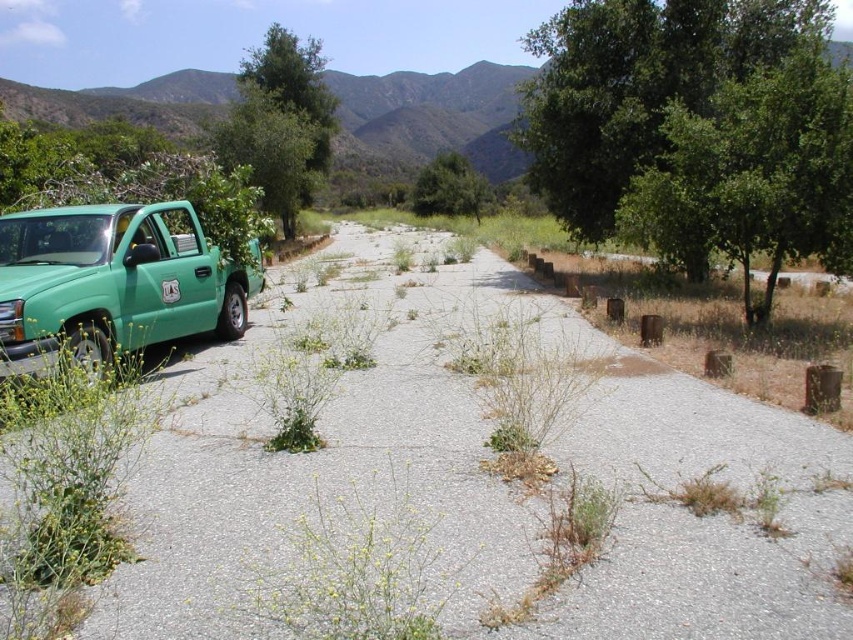
Question: In this image, where is gray gravel at left located relative to green leafy tree at upper right?

Choices:
 (A) left
 (B) right

Answer: (A)

Question: Among these objects, which one is farthest from the camera?

Choices:
 (A) green leafy tree at upper left
 (B) green matte truck at left

Answer: (A)

Question: Is green leafy tree at upper right to the left of green leafy tree at center from the viewer's perspective?

Choices:
 (A) no
 (B) yes

Answer: (A)

Question: Does green leafy tree at upper right have a greater width compared to green leafy tree at upper left?

Choices:
 (A) no
 (B) yes

Answer: (A)

Question: Which object is farther from the camera taking this photo?

Choices:
 (A) green leafy tree at upper right
 (B) green leafy tree at upper left

Answer: (B)

Question: Which point appears closest to the camera in this image?

Choices:
 (A) (753, 216)
 (B) (10, 300)
 (C) (466, 196)

Answer: (B)